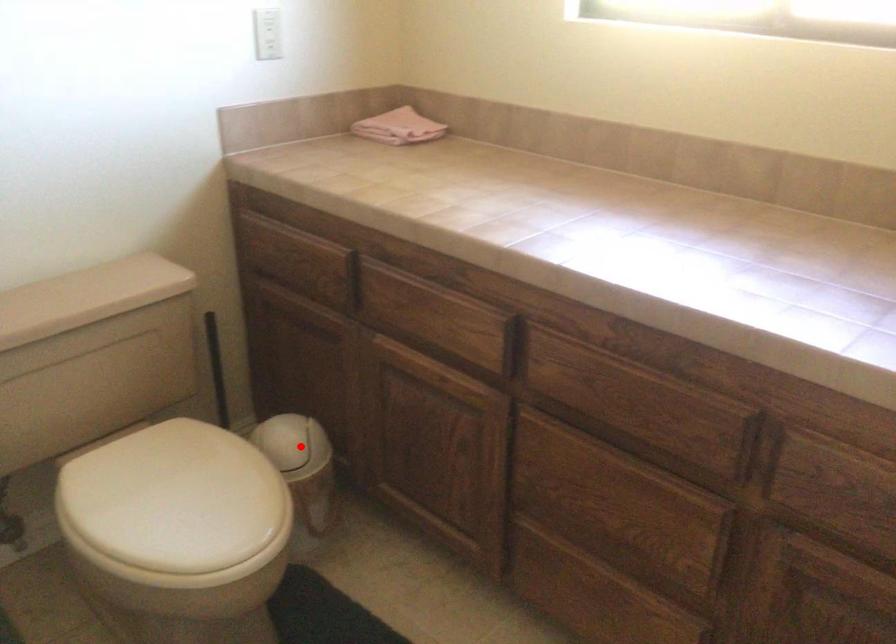
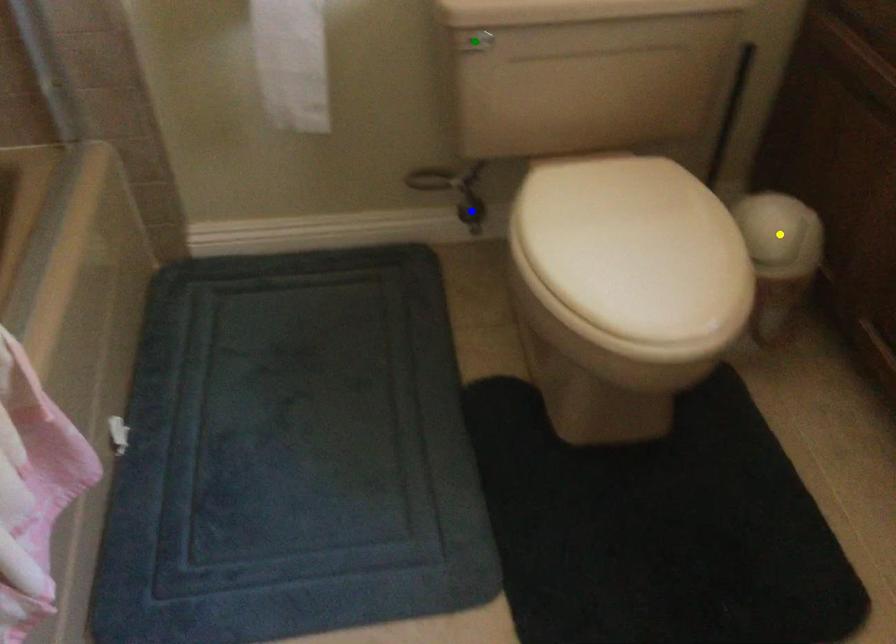
Question: I am providing you with two images of the same scene from different viewpoints. A red point is marked on the first image. You are given multiple points on the second image. Which point in image 2 represents the same 3d spot as the red point in image 1?

Choices:
 (A) yellow point
 (B) green point
 (C) blue point

Answer: (A)